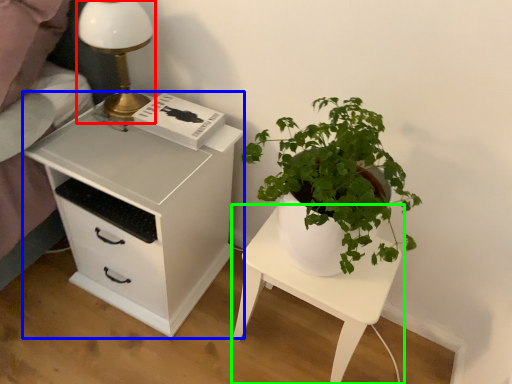
Question: Considering the real-world distances, which object is farthest from table lamp (highlighted by a red box)? chest of drawers (highlighted by a blue box) or nightstand (highlighted by a green box)?

Choices:
 (A) chest of drawers
 (B) nightstand

Answer: (B)